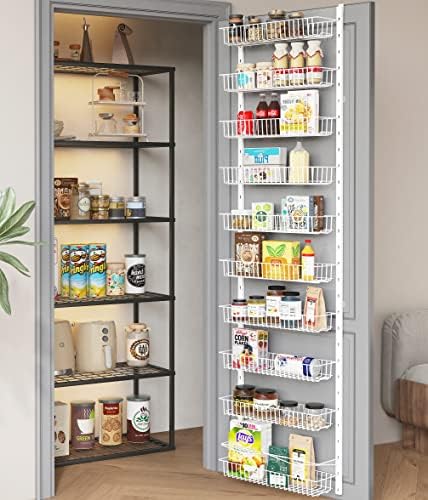
This screenshot has height=500, width=428. I want to click on support leg, so click(x=167, y=122), click(x=138, y=131), click(x=136, y=158), click(x=169, y=160), click(x=169, y=246), click(x=134, y=238), click(x=169, y=315), click(x=140, y=316), click(x=175, y=416), click(x=138, y=390).